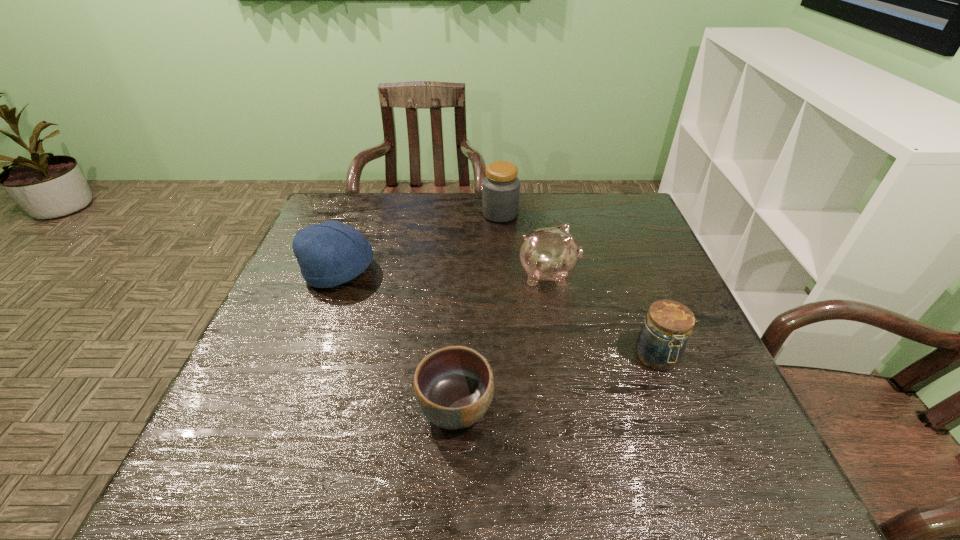
Find the location of `empty space that is in between the bowl and the piggy bank`. empty space that is in between the bowl and the piggy bank is located at coordinates (502, 341).

Where is `vacant area that lies between the bowl and the piggy bank`? vacant area that lies between the bowl and the piggy bank is located at coordinates (502, 341).

This screenshot has width=960, height=540. In order to click on the fourth closest object to the bowl in this screenshot , I will do `click(500, 188)`.

Identify which object is the third closest to the bowl. Please provide its 2D coordinates. Your answer should be formatted as a tuple, i.e. [(x, y)], where the tuple contains the x and y coordinates of a point satisfying the conditions above.

[(662, 340)]

Where is `vacant region that satisfies the following two spatial constraints: 1. on the surface of the farther jar near the warning symbol; 2. on the front facing side of the piggy bank`? This screenshot has width=960, height=540. vacant region that satisfies the following two spatial constraints: 1. on the surface of the farther jar near the warning symbol; 2. on the front facing side of the piggy bank is located at coordinates (504, 274).

The width and height of the screenshot is (960, 540). Find the location of `free space that satisfies the following two spatial constraints: 1. on the front facing side of the piggy bank; 2. on the surface of the left jar near the warning symbol`. free space that satisfies the following two spatial constraints: 1. on the front facing side of the piggy bank; 2. on the surface of the left jar near the warning symbol is located at coordinates (538, 214).

Identify the location of vacant space that satisfies the following two spatial constraints: 1. on the surface of the farthest object near the warning symbol; 2. on the front facing side of the piggy bank. (504, 274).